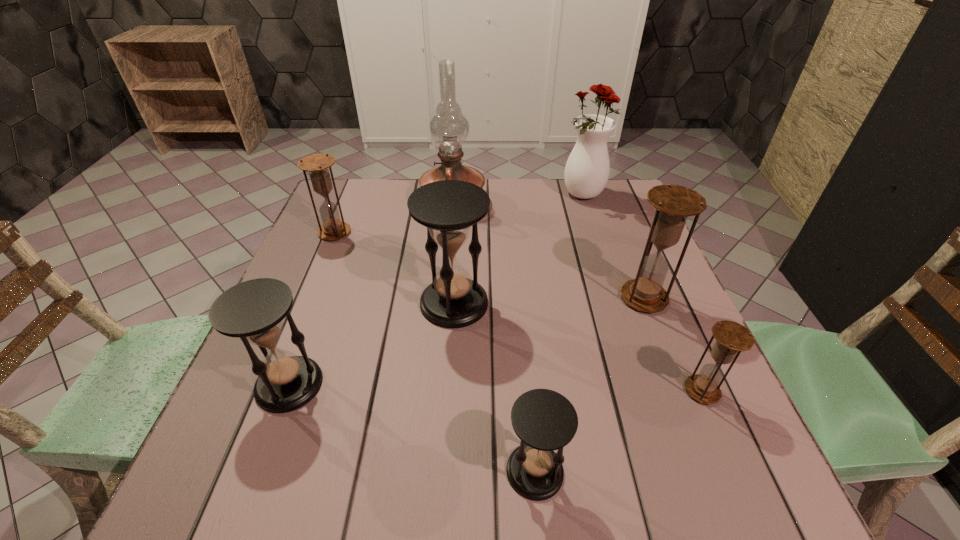
This screenshot has width=960, height=540. Identify the location of oil lamp. (449, 128).

Find the location of `red vase`. red vase is located at coordinates (587, 170).

Identify the location of the second tallest object. (587, 170).

This screenshot has height=540, width=960. I want to click on the farthest black hourglass, so (x=449, y=209).

Where is `the second black hourglass from right to left`? The height and width of the screenshot is (540, 960). the second black hourglass from right to left is located at coordinates (449, 209).

Where is `the second nearest brown hourglass`? The width and height of the screenshot is (960, 540). the second nearest brown hourglass is located at coordinates (673, 203).

Find the location of a particular element. This screenshot has width=960, height=540. the second biggest black hourglass is located at coordinates (253, 311).

The image size is (960, 540). I want to click on the second nearest black hourglass, so click(x=253, y=311).

Locate an element on the screen. the farthest brown hourglass is located at coordinates (317, 165).

Find the location of `the farthest hourglass`. the farthest hourglass is located at coordinates (317, 165).